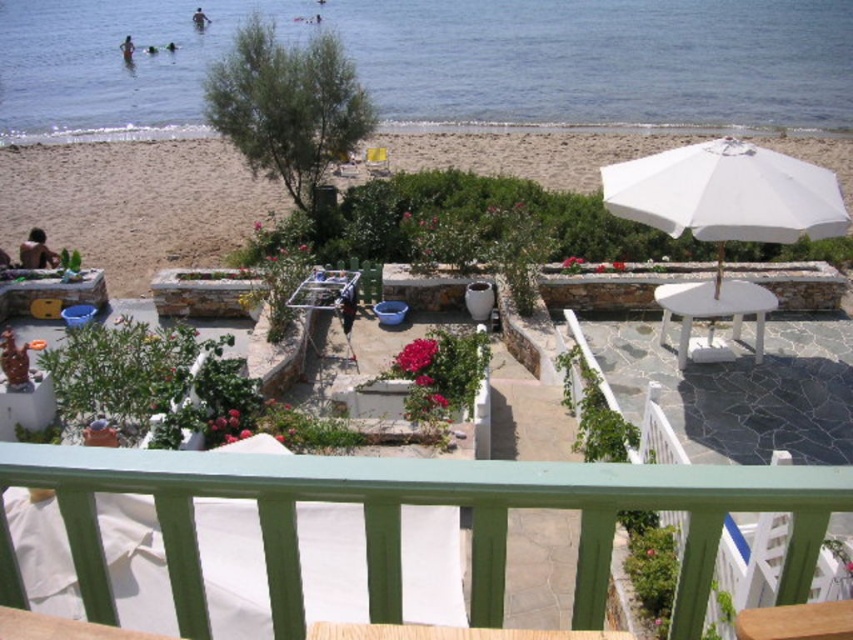
Question: Can you confirm if clear blue water at upper center is positioned to the right of white sand at upper left?

Choices:
 (A) no
 (B) yes

Answer: (A)

Question: Which is farther from the white sand at upper left?

Choices:
 (A) green painted wood railing at center
 (B) yellow fabric chair at center

Answer: (A)

Question: Which is farther from the clear blue water at upper center?

Choices:
 (A) white fabric umbrella at right
 (B) white glossy table at center

Answer: (A)

Question: Which object appears closest to the camera in this image?

Choices:
 (A) yellow fabric chair at center
 (B) white sand at upper left
 (C) green painted wood railing at center
 (D) white fabric umbrella at right

Answer: (C)

Question: Is green painted wood railing at center to the right of yellow fabric chair at center from the viewer's perspective?

Choices:
 (A) no
 (B) yes

Answer: (B)

Question: Is clear blue water at upper center to the left of white fabric umbrella at right from the viewer's perspective?

Choices:
 (A) no
 (B) yes

Answer: (B)